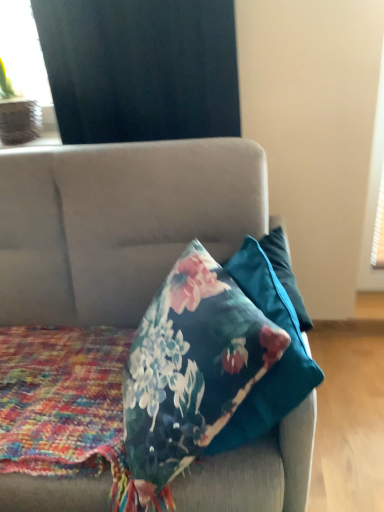
Question: Is velvet floral pillow at center not inside floral fabric pillow at center?

Choices:
 (A) yes
 (B) no

Answer: (A)

Question: Would you consider velvet floral pillow at center to be distant from floral fabric pillow at center?

Choices:
 (A) yes
 (B) no

Answer: (B)

Question: Is velvet floral pillow at center shorter than floral fabric pillow at center?

Choices:
 (A) no
 (B) yes

Answer: (A)

Question: Is velvet floral pillow at center aimed at floral fabric pillow at center?

Choices:
 (A) no
 (B) yes

Answer: (A)

Question: Considering the relative positions of velvet floral pillow at center and floral fabric pillow at center in the image provided, is velvet floral pillow at center to the right of floral fabric pillow at center from the viewer's perspective?

Choices:
 (A) yes
 (B) no

Answer: (B)

Question: Does velvet floral pillow at center have a larger size compared to floral fabric pillow at center?

Choices:
 (A) yes
 (B) no

Answer: (A)

Question: From a real-world perspective, is black matte curtain at upper left physically above matte black curtain at upper left?

Choices:
 (A) no
 (B) yes

Answer: (A)

Question: Is black matte curtain at upper left beside matte black curtain at upper left?

Choices:
 (A) yes
 (B) no

Answer: (B)

Question: Is black matte curtain at upper left shorter than matte black curtain at upper left?

Choices:
 (A) no
 (B) yes

Answer: (B)

Question: Can you confirm if black matte curtain at upper left is smaller than matte black curtain at upper left?

Choices:
 (A) yes
 (B) no

Answer: (B)

Question: Is black matte curtain at upper left facing towards matte black curtain at upper left?

Choices:
 (A) yes
 (B) no

Answer: (B)

Question: Is black matte curtain at upper left not inside matte black curtain at upper left?

Choices:
 (A) yes
 (B) no

Answer: (A)

Question: Is matte black curtain at upper left facing away from floral-patterned fabric at center?

Choices:
 (A) no
 (B) yes

Answer: (A)